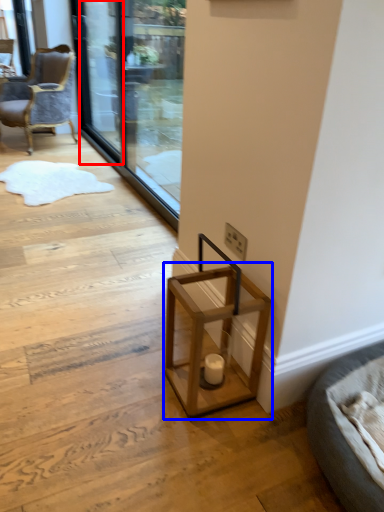
Question: Which of the following is the closest to the observer, screen door (highlighted by a red box) or table (highlighted by a blue box)?

Choices:
 (A) screen door
 (B) table

Answer: (B)